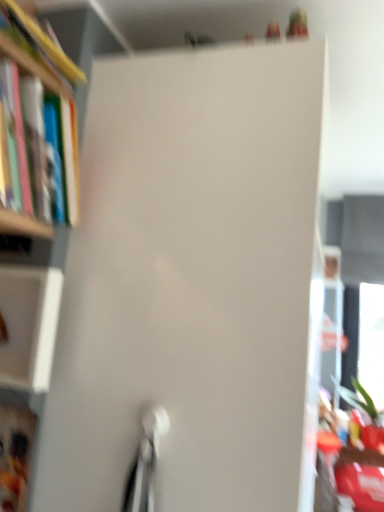
Question: Would you say hardcover book at left, which is counted as the 1th book, starting from the bottom, is outside hardcover book at left, which is the second book from bottom to top?

Choices:
 (A) yes
 (B) no

Answer: (A)

Question: Does hardcover book at left, which is counted as the 1th book, starting from the bottom, come behind hardcover book at left, acting as the 1th book starting from the top?

Choices:
 (A) no
 (B) yes

Answer: (B)

Question: Does hardcover book at left, the second book when ordered from top to bottom, turn towards hardcover book at left, acting as the 1th book starting from the top?

Choices:
 (A) yes
 (B) no

Answer: (B)

Question: Does hardcover book at left, the second book when ordered from top to bottom, have a lesser width compared to hardcover book at left, which is the second book from bottom to top?

Choices:
 (A) yes
 (B) no

Answer: (A)

Question: Considering the relative sizes of hardcover book at left, which is counted as the 1th book, starting from the bottom, and hardcover book at left, which is the second book from bottom to top, in the image provided, is hardcover book at left, which is counted as the 1th book, starting from the bottom, wider than hardcover book at left, which is the second book from bottom to top,?

Choices:
 (A) yes
 (B) no

Answer: (B)

Question: Considering the relative positions of white matte cabinet at left, the second cabinet from the bottom, and hardcover book at left, the second book when ordered from top to bottom, in the image provided, is white matte cabinet at left, the second cabinet from the bottom, to the left or to the right of hardcover book at left, the second book when ordered from top to bottom,?

Choices:
 (A) left
 (B) right

Answer: (B)

Question: Is white matte cabinet at left, the second cabinet from the bottom, taller or shorter than hardcover book at left, which is counted as the 1th book, starting from the bottom?

Choices:
 (A) short
 (B) tall

Answer: (A)

Question: Based on their sizes in the image, would you say white matte cabinet at left, placed as the first cabinet when sorted from top to bottom, is bigger or smaller than hardcover book at left, which is counted as the 1th book, starting from the bottom?

Choices:
 (A) small
 (B) big

Answer: (A)

Question: From the image's perspective, is white matte cabinet at left, placed as the first cabinet when sorted from top to bottom, located above or below hardcover book at left, the second book when ordered from top to bottom?

Choices:
 (A) below
 (B) above

Answer: (A)

Question: Is hardcover book at left, the second book when ordered from top to bottom, situated inside matte plastic cabinet at lower left, which appears as the 1th cabinet when ordered from the bottom, or outside?

Choices:
 (A) inside
 (B) outside

Answer: (B)

Question: Is point (61, 59) closer or farther from the camera than point (3, 409)?

Choices:
 (A) farther
 (B) closer

Answer: (A)

Question: From a real-world perspective, is hardcover book at left, which is counted as the 1th book, starting from the bottom, above or below matte plastic cabinet at lower left, which appears as the 1th cabinet when ordered from the bottom?

Choices:
 (A) above
 (B) below

Answer: (A)

Question: Considering the positions of hardcover book at left, the second book when ordered from top to bottom, and matte plastic cabinet at lower left, which appears as the 1th cabinet when ordered from the bottom, in the image, is hardcover book at left, the second book when ordered from top to bottom, wider or thinner than matte plastic cabinet at lower left, which appears as the 1th cabinet when ordered from the bottom,?

Choices:
 (A) wide
 (B) thin

Answer: (A)

Question: Considering the positions of point (52, 323) and point (56, 62), is point (52, 323) closer or farther from the camera than point (56, 62)?

Choices:
 (A) farther
 (B) closer

Answer: (A)

Question: From the image's perspective, is white matte cabinet at left, the second cabinet from the bottom, located above or below hardcover book at left, acting as the 1th book starting from the top?

Choices:
 (A) above
 (B) below

Answer: (B)